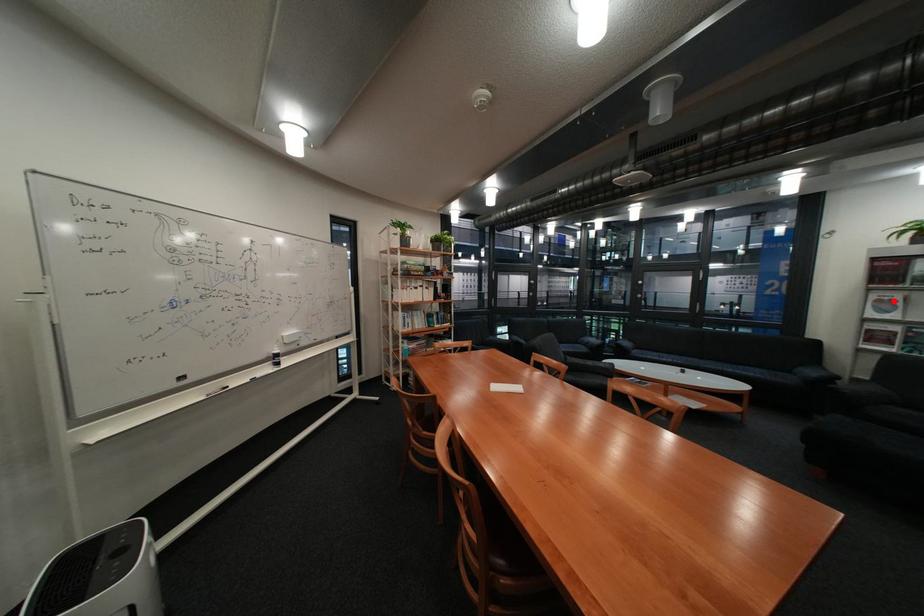
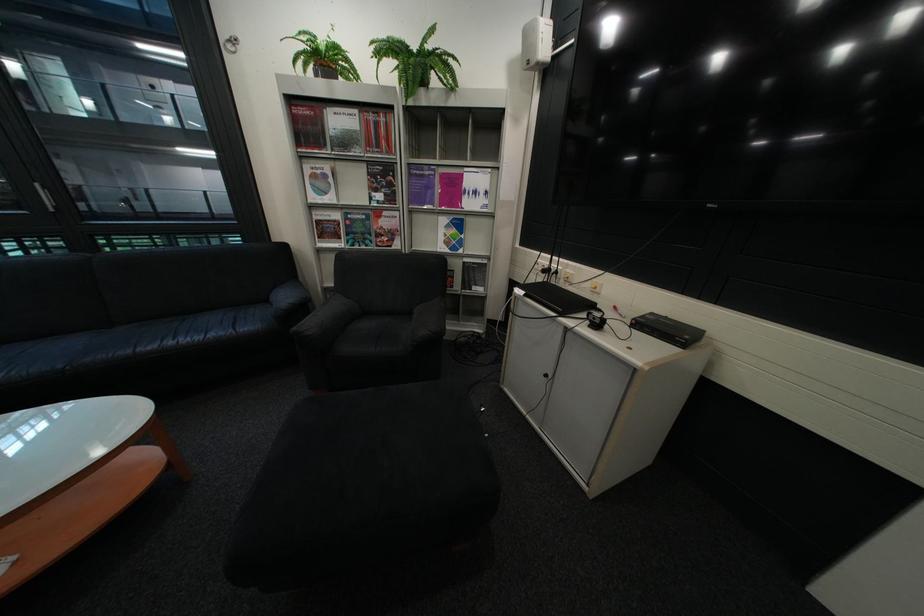
Question: A red point is marked in image1. In image2, is the corresponding 3D point closer to the camera or farther? Reply with the corresponding letter.

Choices:
 (A) The corresponding 3D point is closer.
 (B) The corresponding 3D point is farther.

Answer: (A)